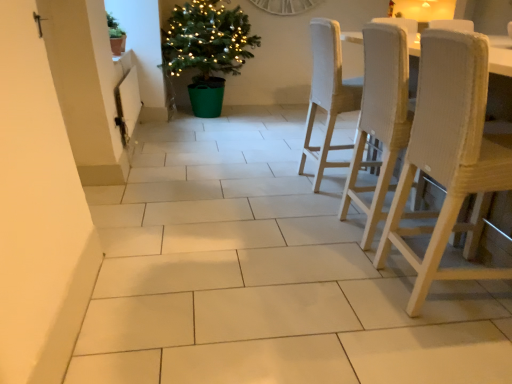
Question: Is woven fabric chair at right, acting as the second chair starting from the back, thinner than white textured wood chair at right, the third chair from the back?

Choices:
 (A) yes
 (B) no

Answer: (B)

Question: Is woven fabric chair at right, acting as the second chair starting from the back, wider than white textured wood chair at right, which is the 1th chair from front to back?

Choices:
 (A) yes
 (B) no

Answer: (A)

Question: Can you confirm if woven fabric chair at right, the 2th chair viewed from the front, is bigger than white textured wood chair at right, the third chair from the back?

Choices:
 (A) no
 (B) yes

Answer: (B)

Question: Is woven fabric chair at right, acting as the second chair starting from the back, oriented towards white textured wood chair at right, which is the 1th chair from front to back?

Choices:
 (A) no
 (B) yes

Answer: (A)

Question: Can you confirm if woven fabric chair at right, acting as the second chair starting from the back, is smaller than white textured wood chair at right, which is the 1th chair from front to back?

Choices:
 (A) no
 (B) yes

Answer: (A)

Question: Considering the positions of woven fabric chair at right, acting as the second chair starting from the back, and green plastic potted plant at center-left, which ranks as the first houseplant in right-to-left order, in the image, is woven fabric chair at right, acting as the second chair starting from the back, wider or thinner than green plastic potted plant at center-left, which ranks as the first houseplant in right-to-left order,?

Choices:
 (A) thin
 (B) wide

Answer: (A)

Question: From the image's perspective, is woven fabric chair at right, the 2th chair viewed from the front, positioned above or below green plastic potted plant at center-left, which appears as the 2th houseplant when viewed from the front?

Choices:
 (A) below
 (B) above

Answer: (A)

Question: Relative to green plastic potted plant at center-left, the 1th houseplant in the back-to-front sequence, is woven fabric chair at right, the 2th chair viewed from the front, in front or behind?

Choices:
 (A) behind
 (B) front

Answer: (B)

Question: Looking at the image, does woven fabric chair at right, the 2th chair viewed from the front, seem bigger or smaller compared to green plastic potted plant at center-left, which ranks as the first houseplant in right-to-left order?

Choices:
 (A) big
 (B) small

Answer: (B)

Question: Considering the relative positions of matte brown pot at upper left and green plastic potted plant at center-left, which ranks as the first houseplant in right-to-left order, in the image provided, is matte brown pot at upper left to the left or to the right of green plastic potted plant at center-left, which ranks as the first houseplant in right-to-left order,?

Choices:
 (A) left
 (B) right

Answer: (A)

Question: From the image's perspective, is matte brown pot at upper left positioned above or below green plastic potted plant at center-left, which ranks as the first houseplant in right-to-left order?

Choices:
 (A) above
 (B) below

Answer: (B)

Question: Is point (117, 51) positioned closer to the camera than point (212, 117)?

Choices:
 (A) closer
 (B) farther

Answer: (A)

Question: Is matte brown pot at upper left situated inside green plastic potted plant at center-left, the 1th houseplant in the back-to-front sequence, or outside?

Choices:
 (A) inside
 (B) outside

Answer: (B)

Question: Looking at their shapes, would you say woven fabric chair at right, acting as the second chair starting from the back, is wider or thinner than white textured wood chair at right, which is the 1th chair from front to back?

Choices:
 (A) wide
 (B) thin

Answer: (A)

Question: Based on their sizes in the image, would you say woven fabric chair at right, the 2th chair viewed from the front, is bigger or smaller than white textured wood chair at right, which is the 1th chair from front to back?

Choices:
 (A) small
 (B) big

Answer: (B)